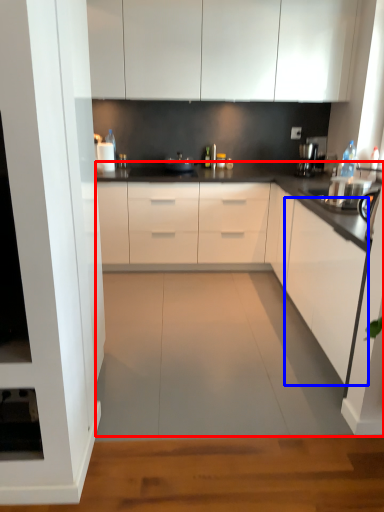
Question: Which object is closer to the camera taking this photo, countertop (highlighted by a red box) or cabinetry (highlighted by a blue box)?

Choices:
 (A) countertop
 (B) cabinetry

Answer: (A)